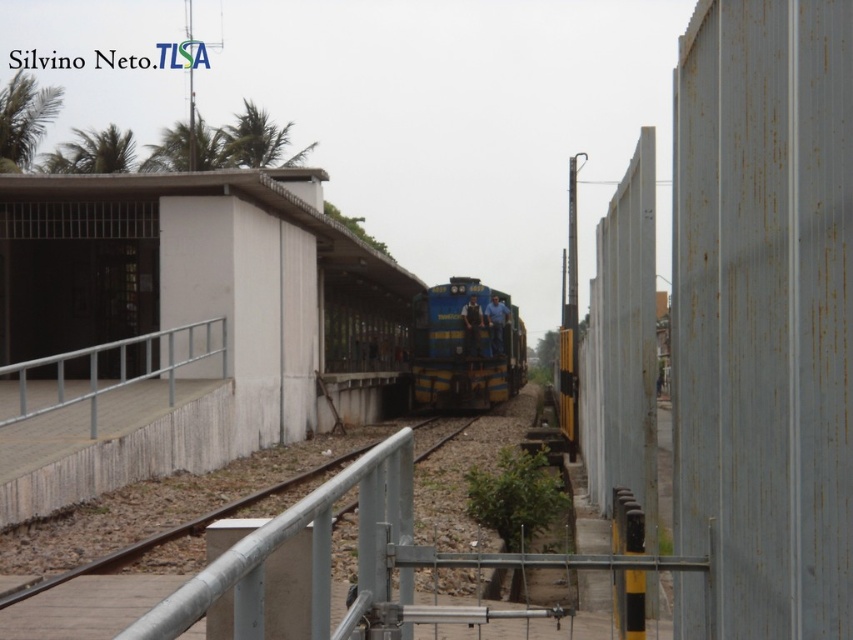
You are a maintenance worker on the train approaching the white concrete platform at left. You need to reach the silver metallic handrail at lower left once you arrive. Can you step directly from the platform to the handrail without needing a ladder?

The distance between the white concrete platform at left and the silver metallic handrail at lower left is 15.47 feet, which is quite large. You would need a ladder or some other equipment to safely reach the handrail from the platform.